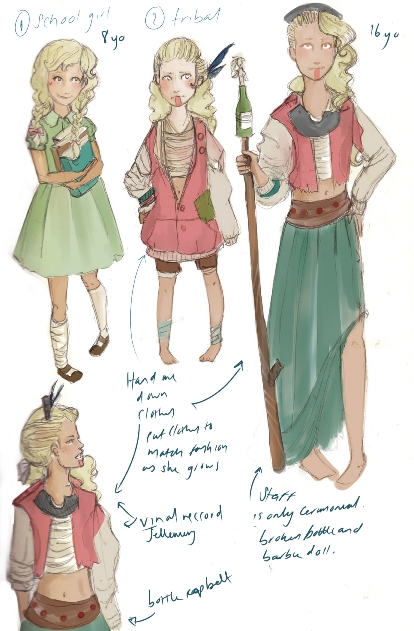
The width and height of the screenshot is (414, 631). I want to click on bottle, so click(x=247, y=115).